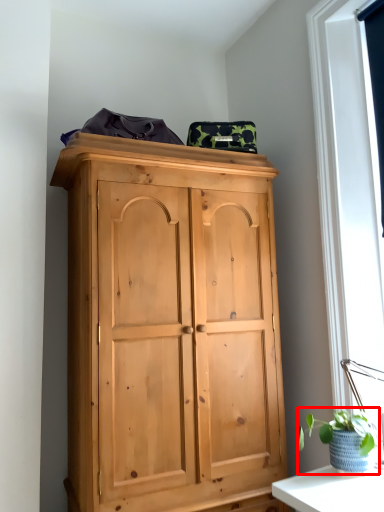
Question: From the image, what is the correct spatial relationship of houseplant (annotated by the red box) in relation to window screen?

Choices:
 (A) right
 (B) left

Answer: (B)